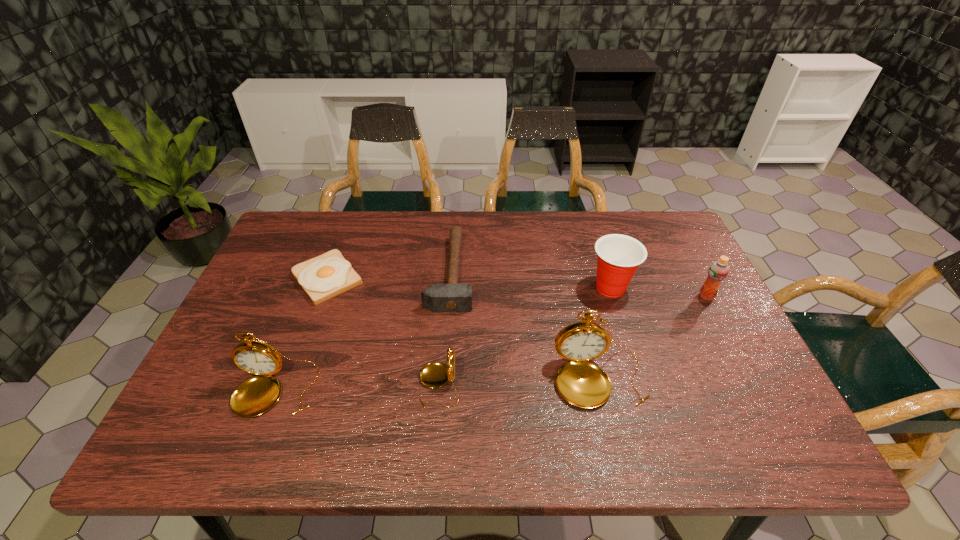
You are a GUI agent. You are given a task and a screenshot of the screen. Output one action in this format:
    pyautogui.click(x=<x>, y=<y>)
    Task: Click on the vacant space situated 0.300m on the face of the fifth tallest object
    
    Given the screenshot: What is the action you would take?
    pyautogui.click(x=289, y=384)

At what (x,y) coordinates should I click in order to perform the action: click on blank space located 0.070m on the back of the toast. Please return your answer as a coordinate pair (x, y). Image resolution: width=960 pixels, height=540 pixels. Looking at the image, I should click on (342, 240).

The width and height of the screenshot is (960, 540). Find the location of `free space located on the striking surface of the second shortest object`. free space located on the striking surface of the second shortest object is located at coordinates (564, 272).

Identify the location of free space located on the back of the cup. This screenshot has width=960, height=540. (601, 256).

Where is `free space located on the left of the rightmost object`? The width and height of the screenshot is (960, 540). free space located on the left of the rightmost object is located at coordinates (594, 296).

Identify the location of toast that is at the far edge. (328, 275).

At what (x,y) coordinates should I click in order to perform the action: click on hammer at the far edge. Please return your answer as a coordinate pair (x, y). The image size is (960, 540). Looking at the image, I should click on (452, 297).

I want to click on pocket watch located in the left edge section of the desktop, so click(x=256, y=395).

You are a GUI agent. You are given a task and a screenshot of the screen. Output one action in this format:
    pyautogui.click(x=<x>, y=<y>)
    Task: Click on the toast present at the left edge
    
    Given the screenshot: What is the action you would take?
    pyautogui.click(x=328, y=275)

The height and width of the screenshot is (540, 960). Identify the location of object at the right edge. (718, 270).